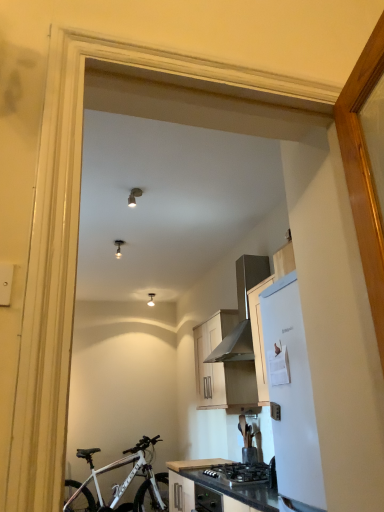
Question: Is metallic silver range hood at upper right in front of or behind black granite countertop at lower center in the image?

Choices:
 (A) behind
 (B) front

Answer: (B)

Question: Is metallic silver range hood at upper right inside the boundaries of black granite countertop at lower center, or outside?

Choices:
 (A) outside
 (B) inside

Answer: (A)

Question: Which object is the farthest from the black granite countertop at lower center?

Choices:
 (A) metallic silver range hood at upper right
 (B) white matte refrigerator at right
 (C) matte wood cabinet at center
 (D) white matte bicycle at lower left

Answer: (D)

Question: Which is farther from the metallic silver range hood at upper right?

Choices:
 (A) black granite countertop at lower center
 (B) matte wood cabinet at center
 (C) white matte refrigerator at right
 (D) white matte bicycle at lower left

Answer: (D)